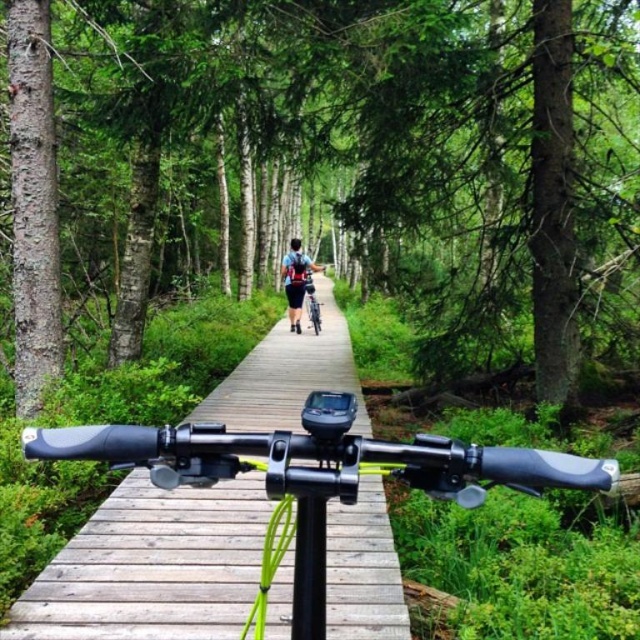
Looking at this image, you are riding a bicycle on a forest boardwalk and want to know which of the two points, point (145, 570) or point (300, 278), is closer to you. Based on the scene description, which point is nearer?

Point (145, 570) is closer to the camera than point (300, 278).

You are riding a silver metallic bicycle at center along a forest boardwalk and see a green matte tree at center ahead. Can you pass under the tree without bending down?

The green matte tree at center has a greater height compared to the silver metallic bicycle at center. Since the tree is taller than the bicycle, you can pass under it without needing to bend down.